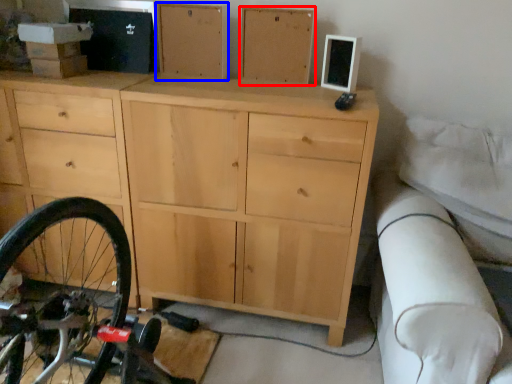
Question: Which object is closer to the camera taking this photo, chest of drawer (highlighted by a red box) or chest of drawer (highlighted by a blue box)?

Choices:
 (A) chest of drawer
 (B) chest of drawer

Answer: (A)